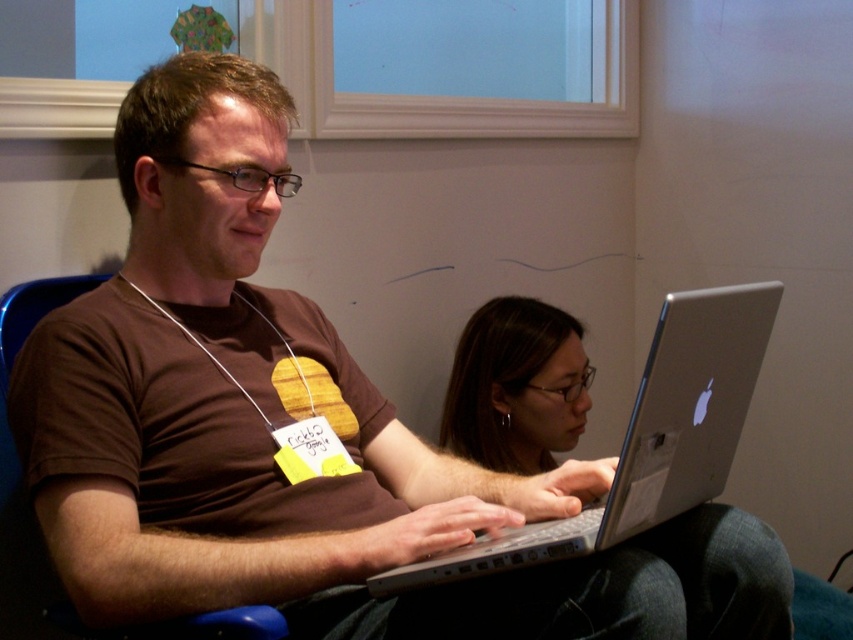
You are trying to decide whether to place a rectangular box that is 15 inches wide on a surface. You see the silver metallic laptop at center and the blue plastic chair at left. Which object can accommodate the box based on their widths?

The silver metallic laptop at center has a larger width than the blue plastic chair at left, so the box can fit on the silver metallic laptop at center.

Consider the image. You are a photographer trying to capture a clear shot of both the silver metallic laptop at center and the matte black hair at center in the image. Since the background is slightly out of focus, which object should you adjust your camera focus to prioritize for clarity?

The silver metallic laptop at center is below matte black hair at center. Since the matte black hair at center is higher up in the image, adjusting focus to prioritize it would ensure both objects remain in the frame while maintaining clarity for the hair first, as the laptop is positioned lower.